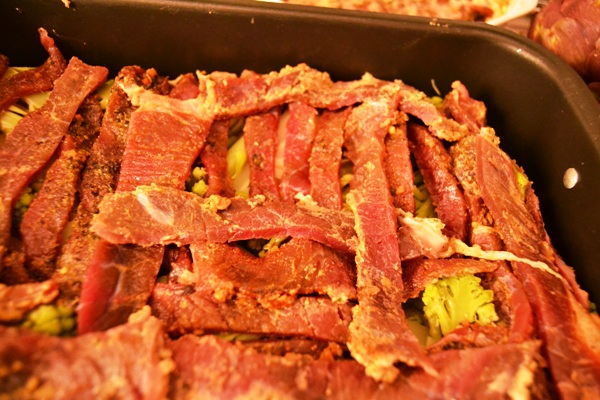
Find the location of a particular element. This screenshot has height=400, width=600. tray is located at coordinates (488, 57).